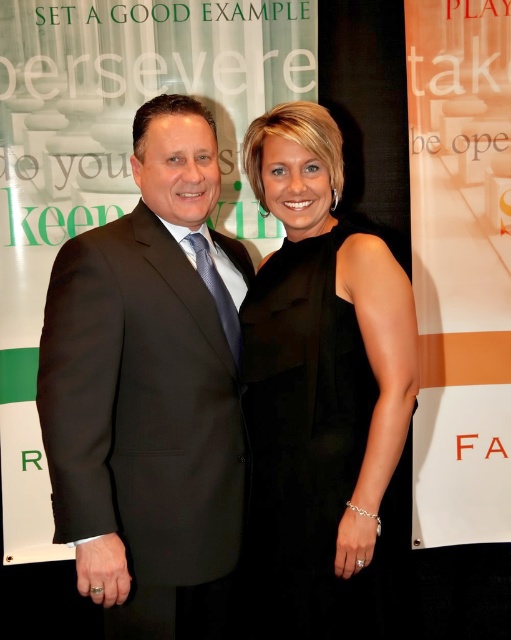
Two people are standing in a photo. The man is on the left and the woman is on the right. The man is wearing a dark suit, white shirt, and blue tie. The woman is in a sleeveless black dress. There is a point at coordinates point (175, 307) between them. If the distance between them is 4.61 feet, can a 5.5 feet long ribbon be placed horizontally between them without bending?

The distance between the two people is 4.61 feet, and the ribbon is 5.5 feet long. Since the ribbon is longer than the distance between them, it can be placed horizontally between them without bending.

You are a photographer setting up for a photoshoot. You have two outfits to display on a mannequin stand. The outfits are the black satin suit at center and the black satin dress at center. Since the stand has limited space, you need to know which outfit takes up less space. Which one should you choose?

The black satin suit at center occupies less space than the black satin dress at center, so you should choose the black satin suit at center to save space on the mannequin stand.

You are a photographer who needs to decide which outfit to recommend for a formal event. Both the black satin suit at center and the black satin dress at center are available. Based on their widths, which one would you suggest if you want a slimmer silhouette?

The black satin suit at center is thinner than the black satin dress at center, so it would be the better choice for a slimmer silhouette.